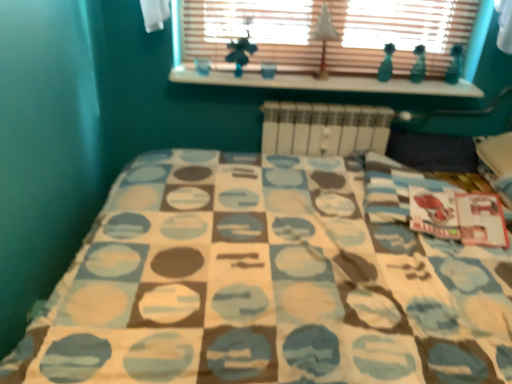
Question: Is the position of wooden blinds at upper center more distant than that of white paper tree at upper center?

Choices:
 (A) yes
 (B) no

Answer: (A)

Question: Is wooden blinds at upper center far from white paper tree at upper center?

Choices:
 (A) no
 (B) yes

Answer: (A)

Question: Is wooden blinds at upper center located outside white paper tree at upper center?

Choices:
 (A) yes
 (B) no

Answer: (A)

Question: Is wooden blinds at upper center oriented towards white paper tree at upper center?

Choices:
 (A) no
 (B) yes

Answer: (B)

Question: Is wooden blinds at upper center taller than white paper tree at upper center?

Choices:
 (A) no
 (B) yes

Answer: (B)

Question: Would you say wooden blinds at upper center contains white paper tree at upper center?

Choices:
 (A) yes
 (B) no

Answer: (B)

Question: From the image's perspective, would you say white paper tree at upper center is positioned over white matte radiator at center?

Choices:
 (A) no
 (B) yes

Answer: (B)

Question: Could you tell me if white paper tree at upper center is turned towards white matte radiator at center?

Choices:
 (A) no
 (B) yes

Answer: (A)

Question: Does white paper tree at upper center appear on the right side of white matte radiator at center?

Choices:
 (A) yes
 (B) no

Answer: (B)

Question: Considering the relative sizes of white paper tree at upper center and white matte radiator at center in the image provided, is white paper tree at upper center thinner than white matte radiator at center?

Choices:
 (A) no
 (B) yes

Answer: (B)

Question: Considering the relative positions of white paper tree at upper center and white matte radiator at center in the image provided, is white paper tree at upper center to the left of white matte radiator at center from the viewer's perspective?

Choices:
 (A) yes
 (B) no

Answer: (A)

Question: Is the depth of white paper tree at upper center greater than that of white matte radiator at center?

Choices:
 (A) no
 (B) yes

Answer: (A)

Question: Can we say white matte radiator at center lies outside white paper tree at upper center?

Choices:
 (A) yes
 (B) no

Answer: (A)